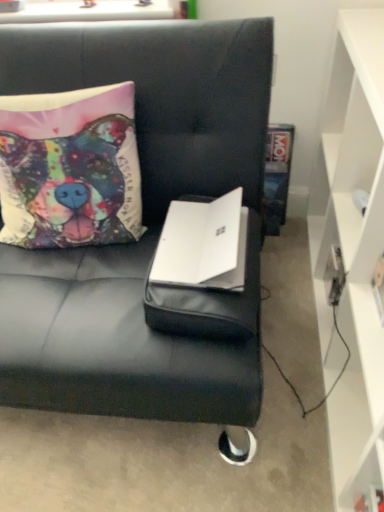
Question: From the image's perspective, is multicolored fabric pillow at upper left located above white matte cabinet at right?

Choices:
 (A) no
 (B) yes

Answer: (B)

Question: Could you tell me if multicolored fabric pillow at upper left is turned towards white matte cabinet at right?

Choices:
 (A) no
 (B) yes

Answer: (A)

Question: Is multicolored fabric pillow at upper left looking in the opposite direction of white matte cabinet at right?

Choices:
 (A) yes
 (B) no

Answer: (B)

Question: Is the depth of multicolored fabric pillow at upper left less than that of white matte cabinet at right?

Choices:
 (A) yes
 (B) no

Answer: (B)

Question: Is multicolored fabric pillow at upper left taller than white matte cabinet at right?

Choices:
 (A) no
 (B) yes

Answer: (A)

Question: Would you say multicolored fabric pillow at upper left is a long distance from white matte cabinet at right?

Choices:
 (A) no
 (B) yes

Answer: (A)

Question: Considering the relative positions of white matte laptop at center and black leather couch at center in the image provided, is white matte laptop at center to the right of black leather couch at center from the viewer's perspective?

Choices:
 (A) no
 (B) yes

Answer: (B)

Question: Considering the relative sizes of white matte laptop at center and black leather couch at center in the image provided, is white matte laptop at center taller than black leather couch at center?

Choices:
 (A) yes
 (B) no

Answer: (B)

Question: Does white matte laptop at center have a lesser height compared to black leather couch at center?

Choices:
 (A) yes
 (B) no

Answer: (A)

Question: Is white matte laptop at center oriented towards black leather couch at center?

Choices:
 (A) no
 (B) yes

Answer: (B)

Question: Is white matte laptop at center bigger than black leather couch at center?

Choices:
 (A) yes
 (B) no

Answer: (B)

Question: Is white matte laptop at center closer to camera compared to black leather couch at center?

Choices:
 (A) no
 (B) yes

Answer: (A)

Question: Does multicolored fabric pillow at upper left turn towards white matte laptop at center?

Choices:
 (A) no
 (B) yes

Answer: (A)